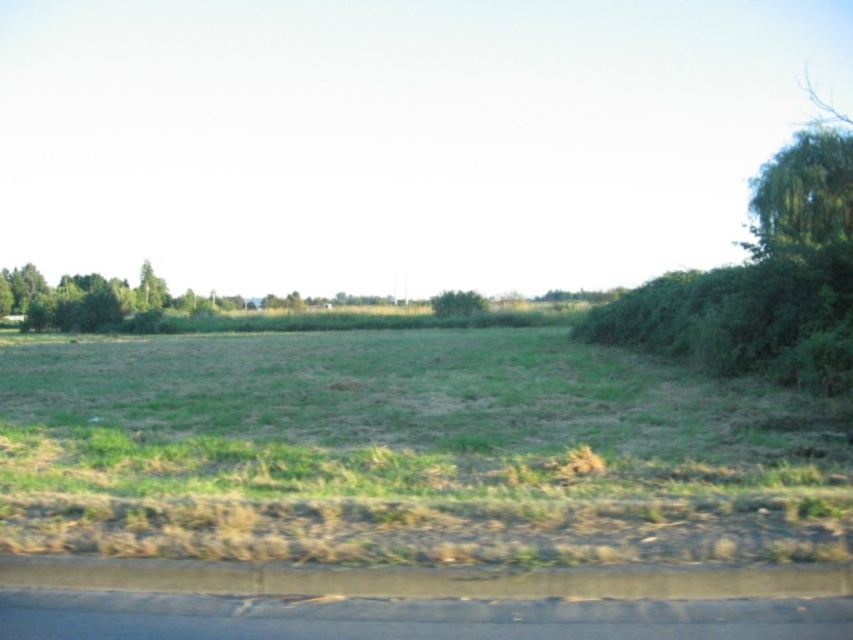
You are standing at the roadside verge in the image and want to walk towards the green leafy tree at center and the green leafy tree at left. Which tree will you encounter first based on their positions?

The green leafy tree at center will be encountered first because it is positioned below the green leafy tree at left, meaning it is closer to the observer standing at the roadside verge.

You are standing in the middle of the field and want to walk towards the green leafy tree at center and the green leafy tree at left. Which tree should you head toward if you want to find a wider tree to rest under?

The green leafy tree at left is wider than the green leafy tree at center, so you should head toward the green leafy tree at left to find a wider tree to rest under.

You are standing in the middle of the field and see the green leafy tree at upper right and the green leafy tree at left. Which tree is located to the right of the other?

The green leafy tree at upper right is positioned on the right side of green leafy tree at left.